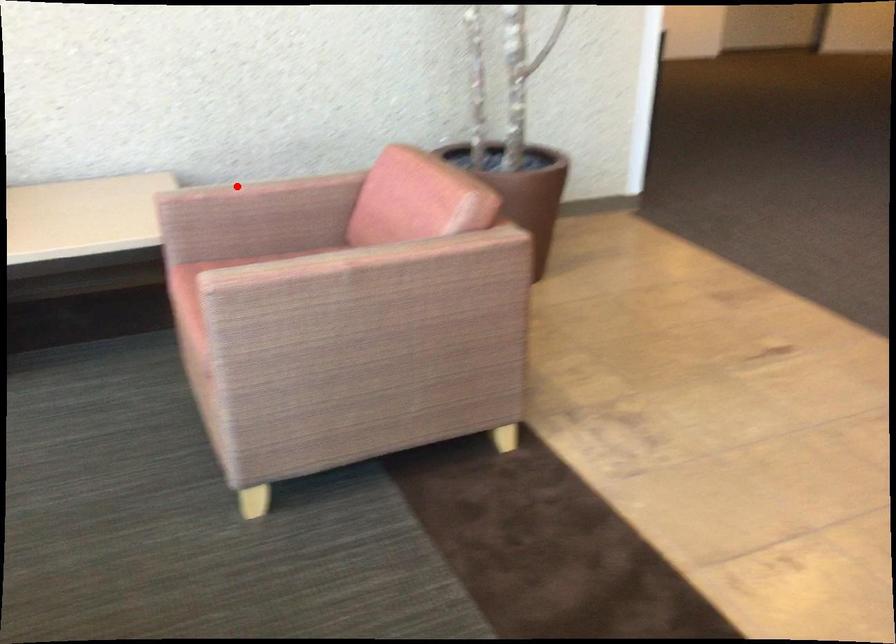
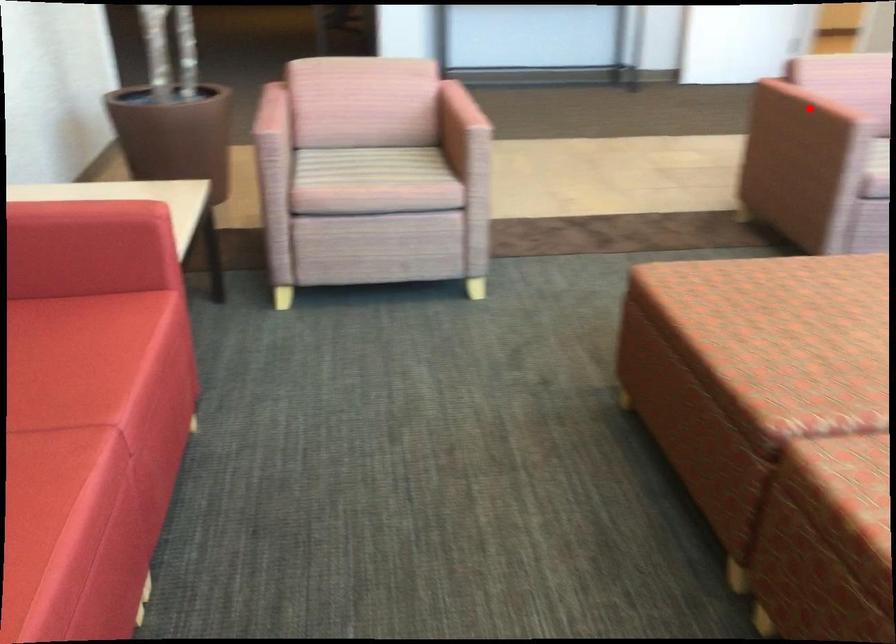
I am providing you with two images of the same scene from different viewpoints. A red point is marked on the first image and another point is marked on the second image. Are the points marked in image1 and image2 representing the same 3D position?

No